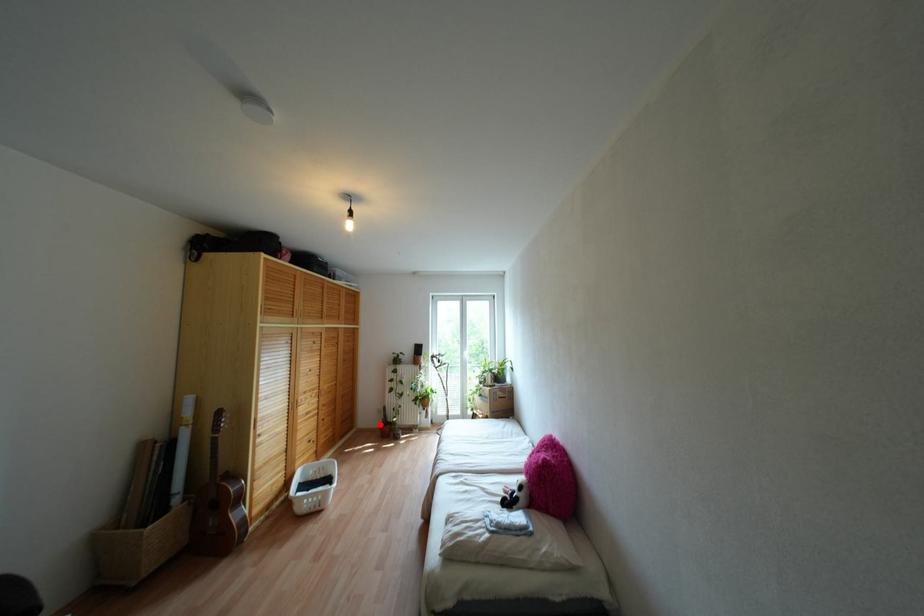
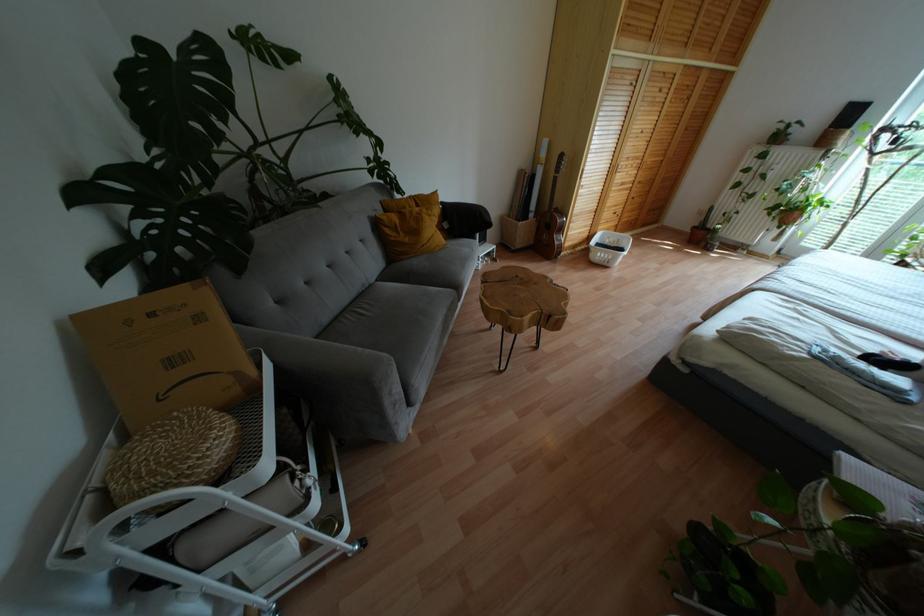
Where in the second image is the point corresponding to the highlighted location from the first image?

(694, 227)